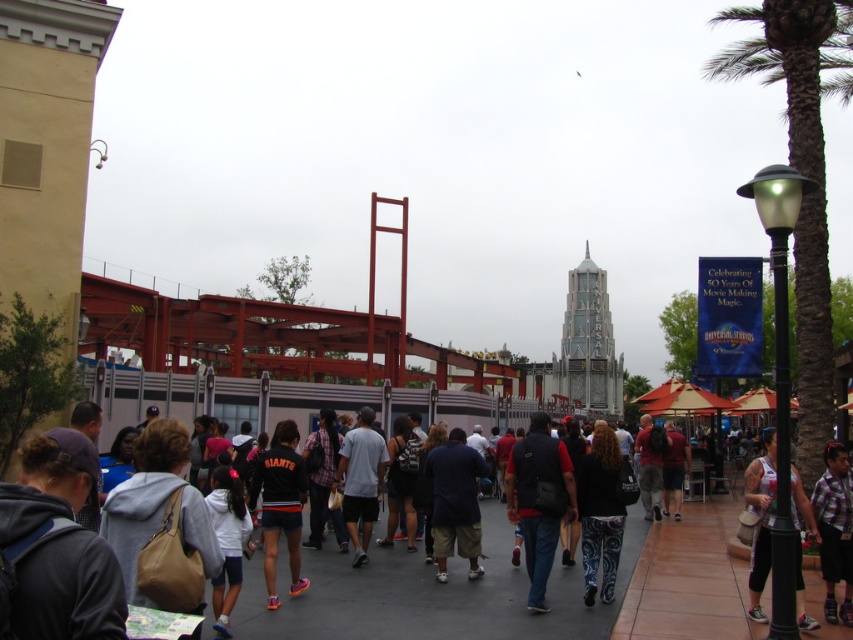
Which is below, dark gray hoodie at lower left or dark blue fabric pants at center?

dark blue fabric pants at center is below.

Does dark gray hoodie at lower left have a smaller size compared to dark blue fabric pants at center?

No, dark gray hoodie at lower left is not smaller than dark blue fabric pants at center.

Is point (77, 449) more distant than point (479, 544)?

No, it is in front of (479, 544).

Image resolution: width=853 pixels, height=640 pixels. I want to click on dark gray hoodie at lower left, so click(68, 589).

Could you measure the distance between purple checkered shirt at lower right and reddish-brown backpack at center-right?

They are 29.74 meters apart.

Does point (825, 465) lie behind point (643, 426)?

No.

The width and height of the screenshot is (853, 640). Identify the location of purple checkered shirt at lower right. (834, 531).

Can you confirm if matte black backpack at center is positioned to the right of purple checkered shirt at lower right?

In fact, matte black backpack at center is to the left of purple checkered shirt at lower right.

From the picture: Does matte black backpack at center appear on the left side of purple checkered shirt at lower right?

Correct, you'll find matte black backpack at center to the left of purple checkered shirt at lower right.

Identify the location of matte black backpack at center. The height and width of the screenshot is (640, 853). (538, 500).